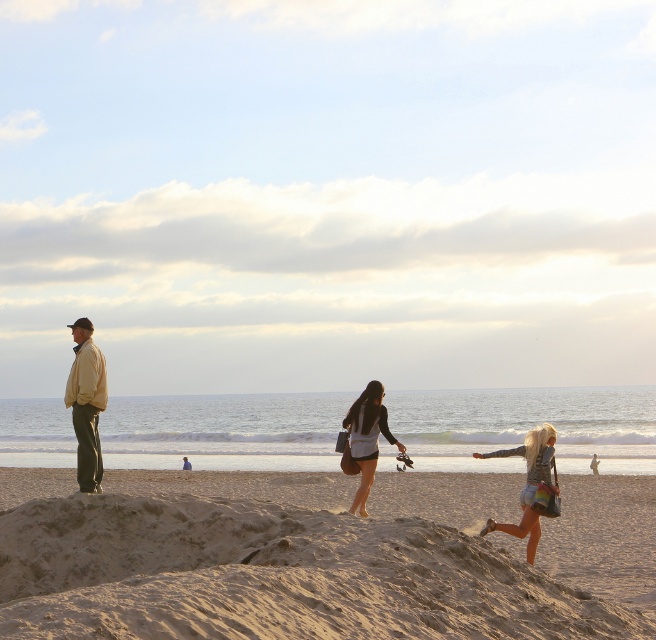
Is point (531, 436) farther from camera compared to point (356, 436)?

No.

Measure the distance between denim shorts at lower right and camera.

13.99 meters

Is point (548, 461) closer to viewer compared to point (361, 458)?

Yes, it is in front of point (361, 458).

The width and height of the screenshot is (656, 640). In order to click on denim shorts at lower right in this screenshot , I will do `click(527, 483)`.

Who is taller, beige sandy mound at center or matte yellow jacket at left?

beige sandy mound at center is taller.

Is point (546, 531) farther from viewer compared to point (98, 369)?

That is True.

The width and height of the screenshot is (656, 640). What are the coordinates of `beige sandy mound at center` in the screenshot? It's located at (318, 556).

Who is shorter, beige sandy mound at center or denim shorts at center?

Standing shorter between the two is denim shorts at center.

Is point (619, 515) positioned before point (377, 385)?

No, (619, 515) is further to viewer.

At what (x,y) coordinates should I click in order to perform the action: click on beige sandy mound at center. Please return your answer as a coordinate pair (x, y). The width and height of the screenshot is (656, 640). Looking at the image, I should click on (318, 556).